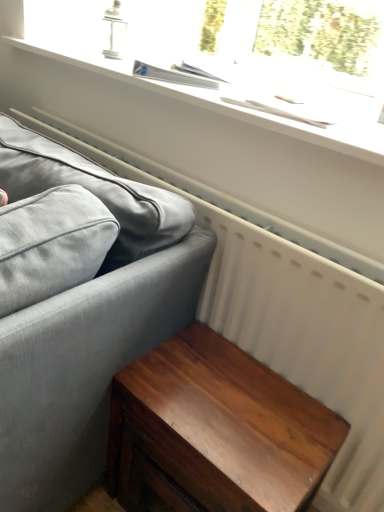
Question: From the image's perspective, relative to shiny brown wood table at lower right, is matte gray fabric couch at left above or below?

Choices:
 (A) below
 (B) above

Answer: (B)

Question: From a real-world perspective, is matte gray fabric couch at left positioned above or below shiny brown wood table at lower right?

Choices:
 (A) above
 (B) below

Answer: (A)

Question: Which object is positioned farthest from the white matte window sill at upper center?

Choices:
 (A) matte gray fabric couch at left
 (B) shiny brown wood table at lower right

Answer: (B)

Question: Which object is positioned farthest from the shiny brown wood table at lower right?

Choices:
 (A) matte gray fabric couch at left
 (B) white matte window sill at upper center

Answer: (B)